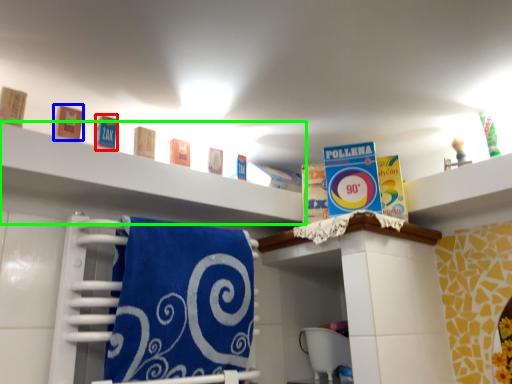
Question: Which object is positioned closest to product (highlighted by a red box)? Select from product (highlighted by a blue box) and shelf (highlighted by a green box).

Choices:
 (A) product
 (B) shelf

Answer: (A)